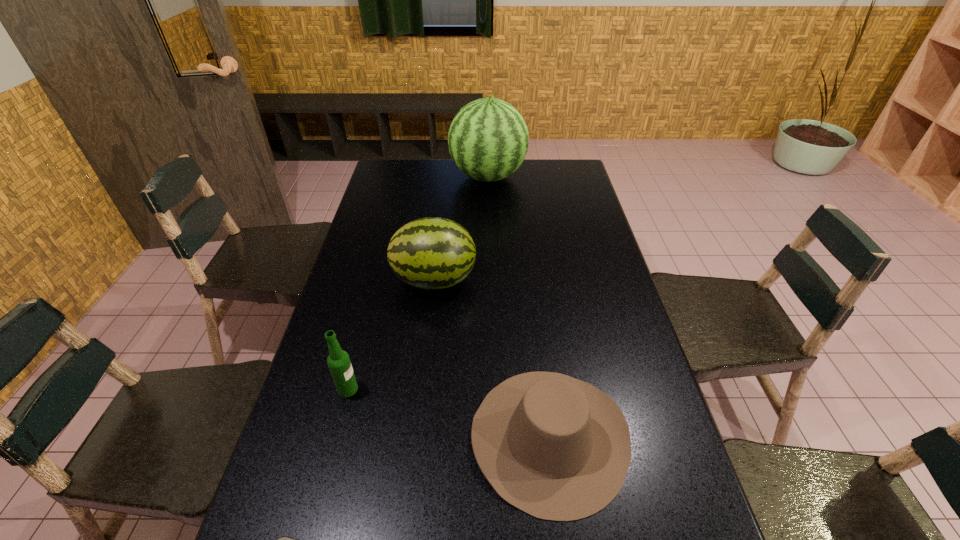
Identify the location of object that is at the far edge. (488, 139).

Locate an element on the screen. watermelon at the left edge is located at coordinates (432, 253).

At what (x,y) coordinates should I click in order to perform the action: click on beer bottle that is at the left edge. Please return your answer as a coordinate pair (x, y). Looking at the image, I should click on (338, 361).

Identify the location of object that is at the right edge. (557, 448).

This screenshot has width=960, height=540. I want to click on free region at the far edge of the desktop, so click(x=423, y=174).

You are a GUI agent. You are given a task and a screenshot of the screen. Output one action in this format:
    pyautogui.click(x=<x>, y=<y>)
    Task: Click on the free spot at the left edge of the desktop
    The height and width of the screenshot is (540, 960).
    Given the screenshot: What is the action you would take?
    pyautogui.click(x=389, y=232)

The height and width of the screenshot is (540, 960). I want to click on vacant space at the right edge of the desktop, so 597,292.

The width and height of the screenshot is (960, 540). Find the location of `vacant area between the nearer watermelon and the beer bottle`. vacant area between the nearer watermelon and the beer bottle is located at coordinates (391, 334).

Identify the location of vacant area that lies between the second shortest object and the farther watermelon. (518, 307).

I want to click on free area in between the cowboy hat and the beer bottle, so click(x=448, y=413).